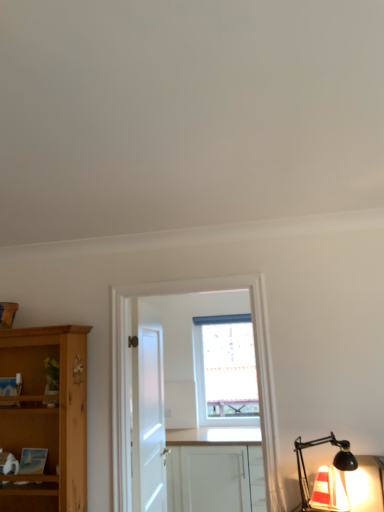
Question: From the image's perspective, is translucent glass lamp at lower right beneath white matte cabinet at center?

Choices:
 (A) yes
 (B) no

Answer: (B)

Question: From the image's perspective, does translucent glass lamp at lower right appear higher than white matte cabinet at center?

Choices:
 (A) yes
 (B) no

Answer: (A)

Question: Is translucent glass lamp at lower right to the left of white matte cabinet at center from the viewer's perspective?

Choices:
 (A) yes
 (B) no

Answer: (B)

Question: Is white matte cabinet at center inside translucent glass lamp at lower right?

Choices:
 (A) yes
 (B) no

Answer: (B)

Question: From a real-world perspective, does translucent glass lamp at lower right sit lower than white matte cabinet at center?

Choices:
 (A) yes
 (B) no

Answer: (B)

Question: From the image's perspective, relative to white matte door at center, is white matte cabinet at center above or below?

Choices:
 (A) above
 (B) below

Answer: (B)

Question: Looking at the image, does white matte cabinet at center seem bigger or smaller compared to white matte door at center?

Choices:
 (A) big
 (B) small

Answer: (A)

Question: Does point (228, 503) appear closer or farther from the camera than point (147, 436)?

Choices:
 (A) closer
 (B) farther

Answer: (B)

Question: Is white matte cabinet at center taller or shorter than white matte door at center?

Choices:
 (A) tall
 (B) short

Answer: (B)

Question: From a real-world perspective, is transparent glass window at center positioned above or below translucent glass lamp at lower right?

Choices:
 (A) above
 (B) below

Answer: (A)

Question: Would you say transparent glass window at center is inside or outside translucent glass lamp at lower right?

Choices:
 (A) inside
 (B) outside

Answer: (B)

Question: Is transparent glass window at center to the left or to the right of translucent glass lamp at lower right in the image?

Choices:
 (A) left
 (B) right

Answer: (A)

Question: From their relative heights in the image, would you say transparent glass window at center is taller or shorter than translucent glass lamp at lower right?

Choices:
 (A) tall
 (B) short

Answer: (A)

Question: In the image, is white matte cabinet at center positioned in front of or behind white wooden cabinet at center?

Choices:
 (A) behind
 (B) front

Answer: (A)

Question: Is white matte cabinet at center inside the boundaries of white wooden cabinet at center, or outside?

Choices:
 (A) inside
 (B) outside

Answer: (B)